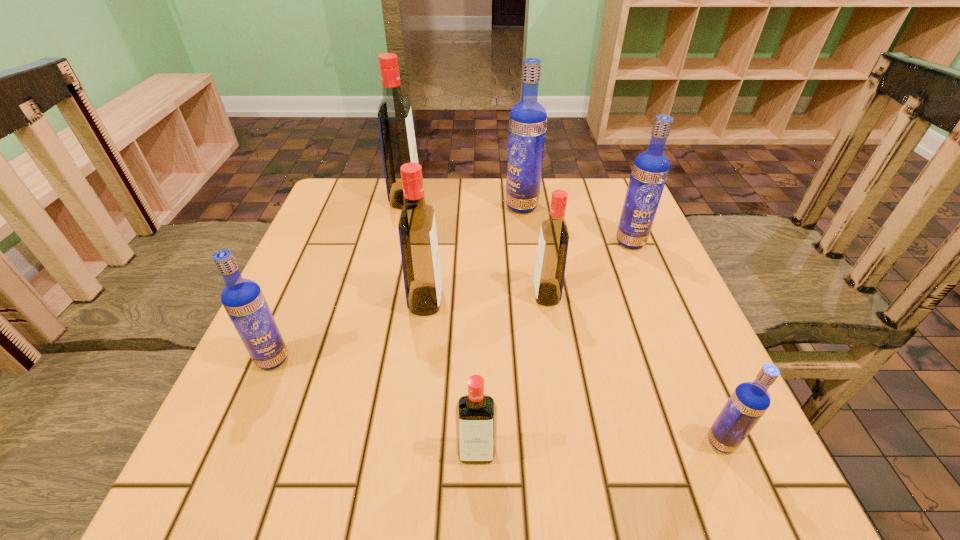
Find the location of a particular element. The width and height of the screenshot is (960, 540). free space between the farthest blue vodka and the second biggest blue vodka is located at coordinates (576, 224).

At what (x,y) coordinates should I click in order to perform the action: click on vacant area that lies between the fifth vodka from right to left and the nearest blue vodka. Please return your answer as a coordinate pair (x, y). The image size is (960, 540). Looking at the image, I should click on (599, 447).

Identify the location of blank region between the smallest blue vodka and the second blue vodka from left to right. The image size is (960, 540). (621, 324).

Locate an element on the screen. object that is the fifth closest to the leftmost red vodka is located at coordinates (650, 169).

Point out which object is positioned as the fifth nearest to the second nearest blue vodka. Please provide its 2D coordinates. Your answer should be formatted as a tuple, i.e. [(x, y)], where the tuple contains the x and y coordinates of a point satisfying the conditions above.

[(528, 119)]

Identify which vodka is located as the fifth nearest to the leftmost blue vodka. Please provide its 2D coordinates. Your answer should be formatted as a tuple, i.e. [(x, y)], where the tuple contains the x and y coordinates of a point satisfying the conditions above.

[(528, 119)]

The width and height of the screenshot is (960, 540). In order to click on the fifth closest vodka to the nearest blue vodka in this screenshot , I will do `click(528, 119)`.

Select which red vodka is the second closest to the third biggest red vodka. Please provide its 2D coordinates. Your answer should be formatted as a tuple, i.e. [(x, y)], where the tuple contains the x and y coordinates of a point satisfying the conditions above.

[(475, 413)]

Locate an element on the screen. This screenshot has height=540, width=960. red vodka that stands as the third closest to the smallest blue vodka is located at coordinates (420, 258).

Identify which blue vodka is the second closest to the second biggest blue vodka. Please provide its 2D coordinates. Your answer should be formatted as a tuple, i.e. [(x, y)], where the tuple contains the x and y coordinates of a point satisfying the conditions above.

[(749, 401)]